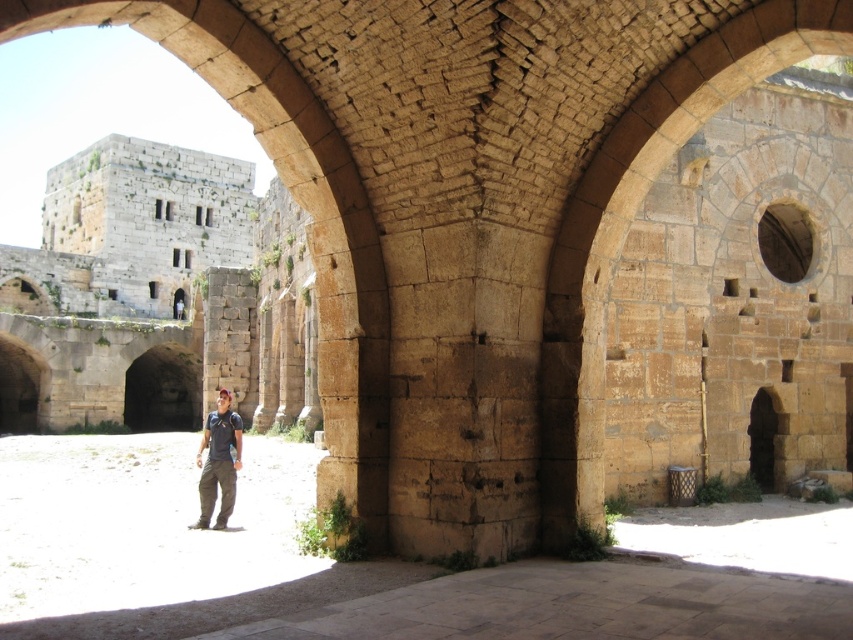
Consider the image. Can you confirm if brown stone archway at center is taller than dark blue t-shirt at center?

Yes, brown stone archway at center is taller than dark blue t-shirt at center.

Between brown stone archway at center and dark blue t-shirt at center, which one is positioned higher?

brown stone archway at center is higher up.

Describe the element at coordinates (628, 224) in the screenshot. I see `brown stone archway at center` at that location.

Locate an element on the screen. The image size is (853, 640). brown stone archway at center is located at coordinates (628, 224).

Who is more distant from viewer, (288, 632) or (563, 324)?

The point (563, 324) is more distant.

Does point (219, 598) lie behind point (621, 116)?

No.

Where is `brown stone courtyard at center`? The image size is (853, 640). brown stone courtyard at center is located at coordinates (368, 563).

Between brown stone courtyard at center and dark blue t-shirt at center, which one appears on the right side from the viewer's perspective?

brown stone courtyard at center

Can you confirm if brown stone courtyard at center is positioned to the left of dark blue t-shirt at center?

Incorrect, brown stone courtyard at center is not on the left side of dark blue t-shirt at center.

Does point (117, 600) come behind point (219, 520)?

No.

Locate an element on the screen. brown stone courtyard at center is located at coordinates (368, 563).